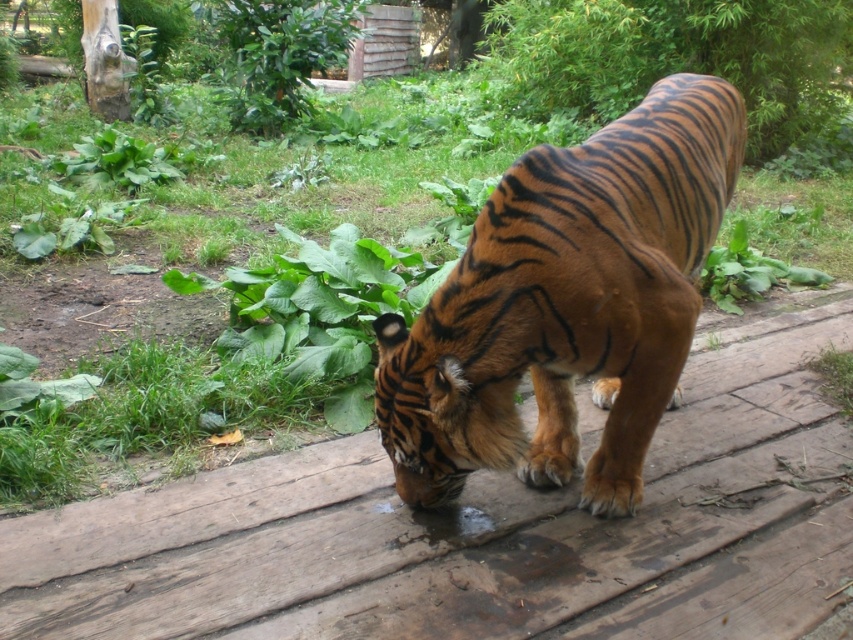
Who is positioned more to the left, wooden plank at center or green leafy grass at center?

green leafy grass at center

Locate an element on the screen. Image resolution: width=853 pixels, height=640 pixels. wooden plank at center is located at coordinates (471, 529).

Identify the location of wooden plank at center. (471, 529).

Is orange-brown fur tiger at center wider than green leafy grass at center?

Incorrect, orange-brown fur tiger at center's width does not surpass green leafy grass at center's.

Is orange-brown fur tiger at center shorter than green leafy grass at center?

No.

Does point (651, 358) come in front of point (373, 314)?

Yes.

What are the coordinates of `orange-brown fur tiger at center` in the screenshot? It's located at (566, 305).

Locate an element on the screen. wooden plank at center is located at coordinates (471, 529).

Who is higher up, wooden plank at center or orange-brown fur tiger at center?

orange-brown fur tiger at center is above.

Which is in front, point (212, 568) or point (664, 96)?

Positioned in front is point (212, 568).

This screenshot has width=853, height=640. I want to click on wooden plank at center, so click(x=471, y=529).